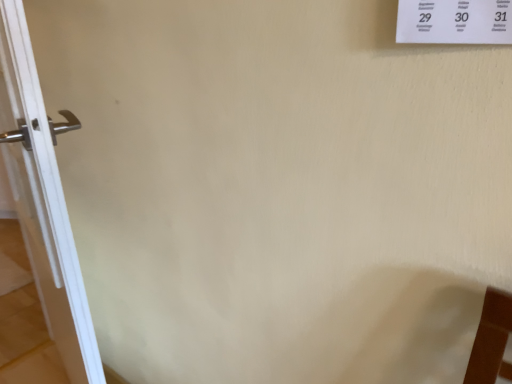
Where is `white glossy door handle at left`? white glossy door handle at left is located at coordinates (44, 202).

This screenshot has height=384, width=512. What do you see at coordinates (44, 202) in the screenshot?
I see `white glossy door handle at left` at bounding box center [44, 202].

Image resolution: width=512 pixels, height=384 pixels. Describe the element at coordinates (454, 21) in the screenshot. I see `white paper at upper right` at that location.

This screenshot has width=512, height=384. I want to click on white paper at upper right, so click(454, 21).

Locate an element on the screen. This screenshot has height=384, width=512. white glossy door handle at left is located at coordinates (44, 202).

Considering the positions of objects white paper at upper right and white glossy door handle at left in the image provided, who is more to the left, white paper at upper right or white glossy door handle at left?

white glossy door handle at left is more to the left.

Considering the relative positions of white paper at upper right and white glossy door handle at left in the image provided, is white paper at upper right behind white glossy door handle at left?

No, white paper at upper right is closer to the viewer.

Does point (407, 33) lie behind point (85, 329)?

No.

From the image's perspective, which is above, white paper at upper right or white glossy door handle at left?

white paper at upper right, from the image's perspective.

From a real-world perspective, which object rests below the other?

white glossy door handle at left.

Is white paper at upper right wider than white glossy door handle at left?

No.

Considering the sizes of white paper at upper right and white glossy door handle at left in the image, is white paper at upper right taller or shorter than white glossy door handle at left?

In the image, white paper at upper right appears to be shorter than white glossy door handle at left.

Looking at the image, does white paper at upper right seem bigger or smaller compared to white glossy door handle at left?

Clearly, white paper at upper right is smaller in size than white glossy door handle at left.

Is white paper at upper right inside the boundaries of white glossy door handle at left, or outside?

white paper at upper right is not inside white glossy door handle at left, it's outside.

Is white paper at upper right far from white glossy door handle at left?

Yes, white paper at upper right and white glossy door handle at left are quite far apart.

Does white paper at upper right turn towards white glossy door handle at left?

No.

What's the angular difference between white paper at upper right and white glossy door handle at left's facing directions?

The facing directions of white paper at upper right and white glossy door handle at left are 12.1 degrees apart.

Measure the distance from white paper at upper right to white glossy door handle at left.

The distance of white paper at upper right from white glossy door handle at left is 1.18 meters.

Where is `poster that is above the white glossy door handle at left (from the image's perspective)`? poster that is above the white glossy door handle at left (from the image's perspective) is located at coordinates (454, 21).

Between white glossy door handle at left and white paper at upper right, which one appears on the right side from the viewer's perspective?

From the viewer's perspective, white paper at upper right appears more on the right side.

Is the depth of white glossy door handle at left greater than that of white paper at upper right?

Result: Yes, it is.

Is point (20, 65) in front of point (504, 19)?

No, (20, 65) is further to viewer.

From the image's perspective, which one is positioned lower, white glossy door handle at left or white paper at upper right?

white glossy door handle at left.

From a real-world perspective, which object rests below the other?

In real-world perspective, white glossy door handle at left is lower.

Considering the relative sizes of white glossy door handle at left and white paper at upper right in the image provided, is white glossy door handle at left thinner than white paper at upper right?

No.

Considering the sizes of white glossy door handle at left and white paper at upper right in the image, is white glossy door handle at left taller or shorter than white paper at upper right?

white glossy door handle at left is taller than white paper at upper right.

Based on the photo, can you confirm if white glossy door handle at left is smaller than white paper at upper right?

Incorrect, white glossy door handle at left is not smaller in size than white paper at upper right.

Is white glossy door handle at left not inside white paper at upper right?

white glossy door handle at left is positioned outside white paper at upper right.

Is white glossy door handle at left not near white paper at upper right?

Absolutely, white glossy door handle at left is distant from white paper at upper right.

Is white glossy door handle at left looking in the opposite direction of white paper at upper right?

No, white paper at upper right is not at the back of white glossy door handle at left.

Identify the location of door below the white paper at upper right (from the image's perspective). This screenshot has height=384, width=512. (44, 202).

Where is `door that is on the left side of white paper at upper right`? This screenshot has height=384, width=512. door that is on the left side of white paper at upper right is located at coordinates (44, 202).

This screenshot has width=512, height=384. In order to click on poster in front of the white glossy door handle at left in this screenshot , I will do `click(454, 21)`.